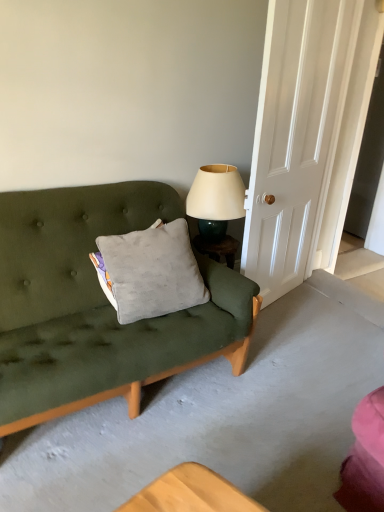
This screenshot has width=384, height=512. Describe the element at coordinates (216, 200) in the screenshot. I see `matte cream lampshade at upper right` at that location.

What is the approximate height of white wood door at right?

white wood door at right is 5.74 feet in height.

Where is `gray velvety pillow at center`? This screenshot has height=512, width=384. gray velvety pillow at center is located at coordinates (150, 272).

Between point (155, 233) and point (311, 149), which one is positioned in front?

The point (155, 233) is more forward.

Considering the sizes of gray velvety pillow at center and white wood door at right in the image, is gray velvety pillow at center bigger or smaller than white wood door at right?

gray velvety pillow at center is smaller than white wood door at right.

Is gray velvety pillow at center looking in the opposite direction of white wood door at right?

gray velvety pillow at center is not turned away from white wood door at right.

From a real-world perspective, relative to white wood door at right, is gray velvety pillow at center vertically above or below?

Clearly, from a real-world perspective, gray velvety pillow at center is below white wood door at right.

Looking at this image, from a real-world perspective, between white wood door at right and matte cream lampshade at upper right, who is vertically higher?

white wood door at right, from a real-world perspective.

Is white wood door at right wider than matte cream lampshade at upper right?

Incorrect, the width of white wood door at right does not surpass that of matte cream lampshade at upper right.

Locate an element on the screen. This screenshot has width=384, height=512. lamp located underneath the white wood door at right (from a real-world perspective) is located at coordinates (216, 200).

From the image's perspective, would you say white wood door at right is shown under matte cream lampshade at upper right?

No.

Is point (189, 278) in front of point (219, 172)?

That is True.

From a real-world perspective, who is located lower, gray velvety pillow at center or matte cream lampshade at upper right?

gray velvety pillow at center, from a real-world perspective.

From the image's perspective, between gray velvety pillow at center and matte cream lampshade at upper right, who is located below?

From the image's view, gray velvety pillow at center is below.

Between matte cream lampshade at upper right and gray velvety pillow at center, which one has smaller width?

Thinner between the two is gray velvety pillow at center.

Can gray velvety pillow at center be found inside matte cream lampshade at upper right?

No, gray velvety pillow at center is not surrounded by matte cream lampshade at upper right.

Is point (228, 206) positioned after point (111, 242)?

Yes, point (228, 206) is farther from viewer.

Visually, is matte cream lampshade at upper right positioned to the left or to the right of gray velvety pillow at center?

Based on their positions, matte cream lampshade at upper right is located to the right of gray velvety pillow at center.

Is white wood door at right surrounded by matte cream lampshade at upper right?

Definitely not — white wood door at right is not inside matte cream lampshade at upper right.

Are matte cream lampshade at upper right and white wood door at right far apart?

No, matte cream lampshade at upper right is in close proximity to white wood door at right.

Considering the positions of objects matte cream lampshade at upper right and white wood door at right in the image provided, who is more to the left, matte cream lampshade at upper right or white wood door at right?

Positioned to the left is matte cream lampshade at upper right.

From the image's perspective, who appears lower, matte cream lampshade at upper right or white wood door at right?

matte cream lampshade at upper right is shown below in the image.

How distant is white wood door at right from gray velvety pillow at center?

white wood door at right is 79.11 centimeters from gray velvety pillow at center.

Looking at this image, how many degrees apart are the facing directions of white wood door at right and gray velvety pillow at center?

19.7 degrees separate the facing orientations of white wood door at right and gray velvety pillow at center.

Is white wood door at right looking in the opposite direction of gray velvety pillow at center?

white wood door at right is not turned away from gray velvety pillow at center.

From a real-world perspective, is white wood door at right below gray velvety pillow at center?

No.

Locate an element on the screen. The image size is (384, 512). door above the gray velvety pillow at center (from a real-world perspective) is located at coordinates (295, 137).

I want to click on door located on the right of matte cream lampshade at upper right, so click(295, 137).

From the image, which object appears to be nearer to matte cream lampshade at upper right, gray velvety pillow at center or white wood door at right?

white wood door at right lies closer to matte cream lampshade at upper right than the other object.

Which object lies further to the anchor point white wood door at right, matte cream lampshade at upper right or gray velvety pillow at center?

gray velvety pillow at center is further to white wood door at right.

Looking at the image, which one is located closer to gray velvety pillow at center, matte cream lampshade at upper right or white wood door at right?

matte cream lampshade at upper right lies closer to gray velvety pillow at center than the other object.

From the picture: Estimate the real-world distances between objects in this image. Which object is closer to matte cream lampshade at upper right, white wood door at right or gray velvety pillow at center?

Based on the image, white wood door at right appears to be nearer to matte cream lampshade at upper right.

Which object lies nearer to the anchor point white wood door at right, gray velvety pillow at center or matte cream lampshade at upper right?

Among the two, matte cream lampshade at upper right is located nearer to white wood door at right.

Considering their positions, is white wood door at right positioned further to gray velvety pillow at center than matte cream lampshade at upper right?

white wood door at right lies further to gray velvety pillow at center than the other object.

Locate an element on the screen. The height and width of the screenshot is (512, 384). lamp located between gray velvety pillow at center and white wood door at right in the left-right direction is located at coordinates (216, 200).